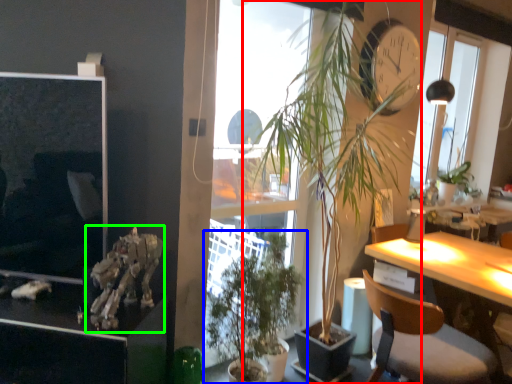
Question: Which is nearer to the houseplant (highlighted by a red box)? houseplant (highlighted by a blue box) or skeleton (highlighted by a green box).

Choices:
 (A) houseplant
 (B) skeleton

Answer: (A)